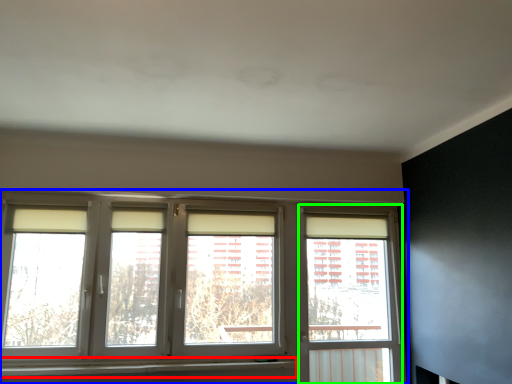
Question: Considering the real-world distances, which object is farthest from window sill (highlighted by a red box)? window (highlighted by a blue box) or window frame (highlighted by a green box)?

Choices:
 (A) window
 (B) window frame

Answer: (B)